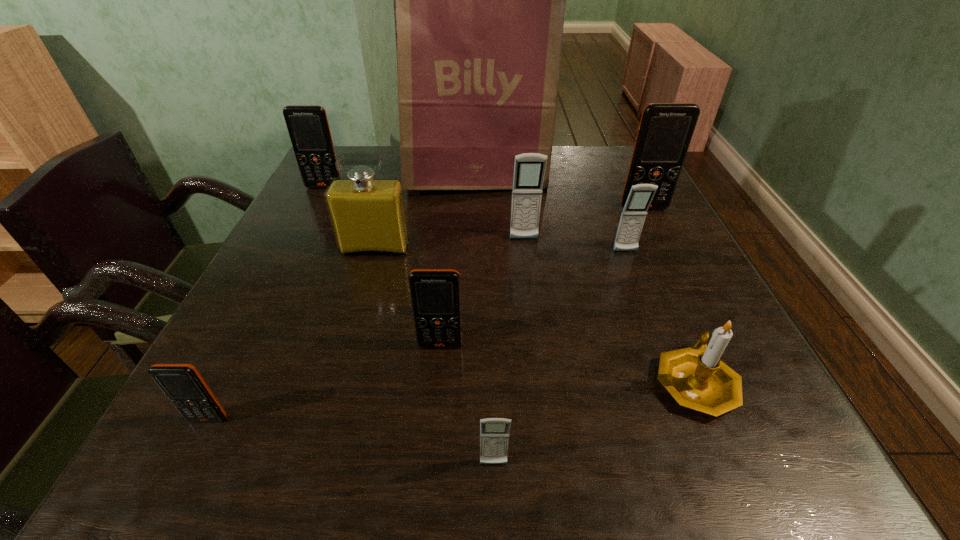
At what (x,y) coordinates should I click in order to perform the action: click on cellular telephone that is the seventh nearest to the perfume. Please return your answer as a coordinate pair (x, y). Looking at the image, I should click on (665, 131).

Find the location of `cellular telephone identified as the third closest to the gold candle holder`. cellular telephone identified as the third closest to the gold candle holder is located at coordinates (435, 294).

This screenshot has width=960, height=540. I want to click on orange cellular telephone that can be found as the fourth closest to the perfume, so click(665, 131).

I want to click on orange cellular telephone that stands as the fourth closest to the candle holder, so click(308, 127).

Locate which gray cellular telephone is the second closest to the smallest orange cellular telephone. Please provide its 2D coordinates. Your answer should be formatted as a tuple, i.e. [(x, y)], where the tuple contains the x and y coordinates of a point satisfying the conditions above.

[(529, 169)]

In order to click on gray cellular telephone that is the closest to the rightmost cellular telephone in this screenshot , I will do `click(632, 219)`.